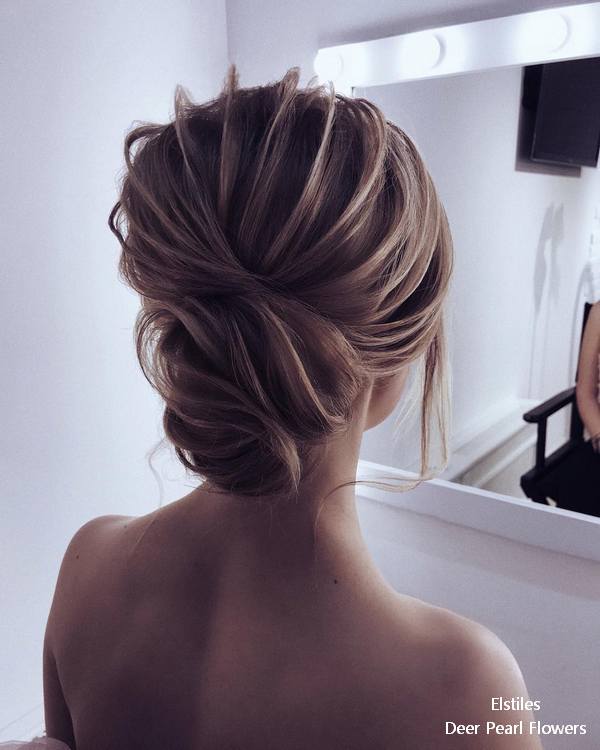
Where is `individual bulbs`? This screenshot has height=750, width=600. individual bulbs is located at coordinates (326, 58), (429, 45), (549, 26).